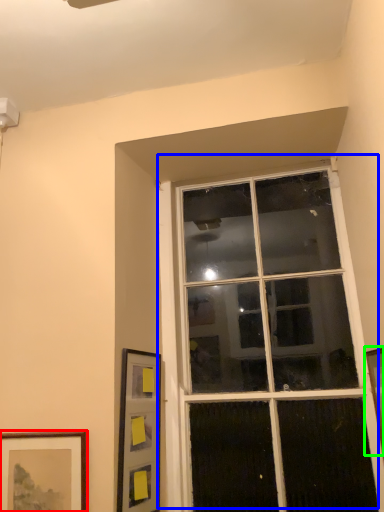
Question: Which object is the farthest from picture frame (highlighted by a red box)? Choose among these: window (highlighted by a blue box) or picture frame (highlighted by a green box).

Choices:
 (A) window
 (B) picture frame

Answer: (B)